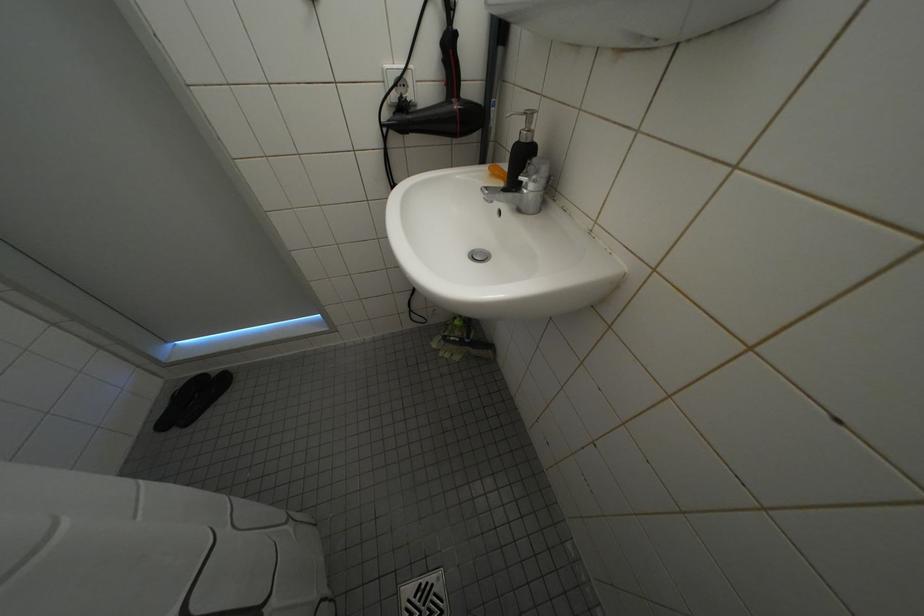
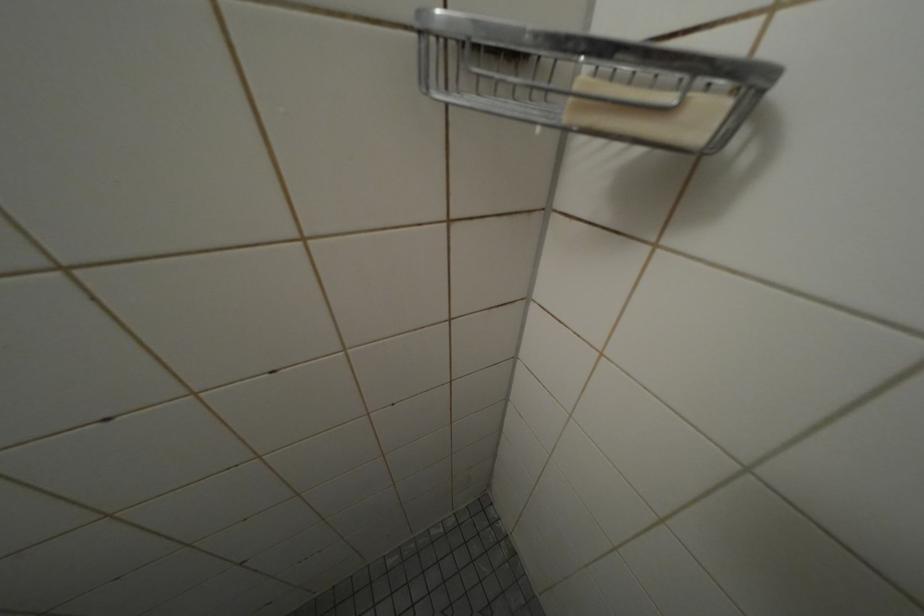
The first image is from the beginning of the video and the second image is from the end. How did the camera likely rotate when shooting the video?

The rotation direction of the camera is right-down.